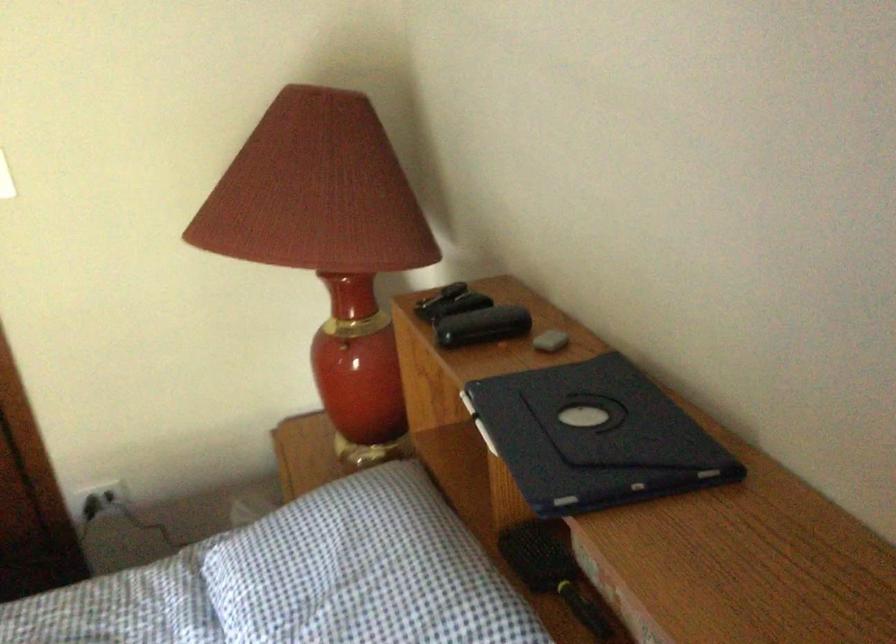
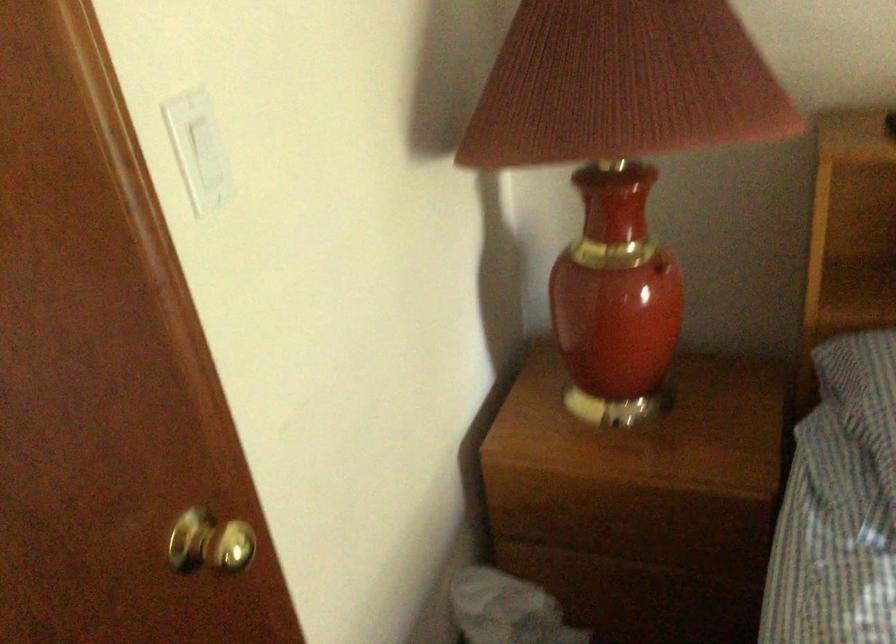
In the second image, find the point that corresponds to pixel 345 336 in the first image.

(661, 267)